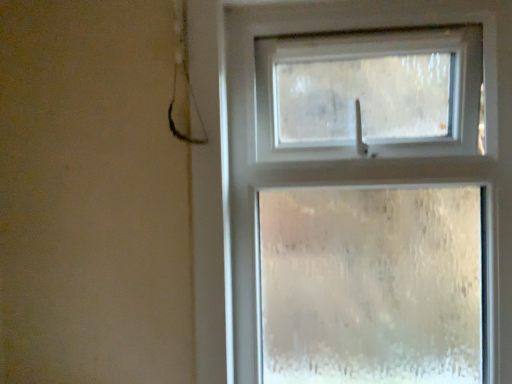
In order to face white frosted glass window at upper right, should I rotate leftwards or rightwards?

It's best to rotate right around 13.328 degrees.

This screenshot has height=384, width=512. What do you see at coordinates (211, 191) in the screenshot?
I see `white frosted glass window at upper right` at bounding box center [211, 191].

At what (x,y) coordinates should I click in order to perform the action: click on white frosted glass window at upper right. Please return your answer as a coordinate pair (x, y). This screenshot has height=384, width=512. Looking at the image, I should click on (211, 191).

The image size is (512, 384). I want to click on white frosted glass window at upper right, so click(211, 191).